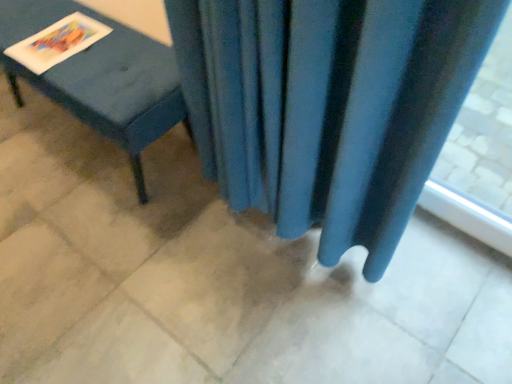
In order to click on vacant space underneath velvet blue table at left (from a real-world perspective) in this screenshot , I will do `click(99, 148)`.